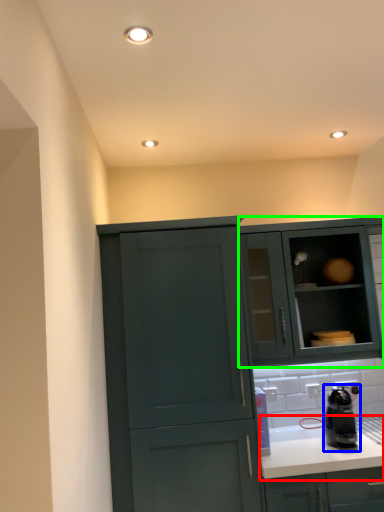
Question: Estimate the real-world distances between objects in this image. Which object is farther from countertop (highlighted by a red box), kitchen appliance (highlighted by a blue box) or cabinetry (highlighted by a green box)?

Choices:
 (A) kitchen appliance
 (B) cabinetry

Answer: (B)